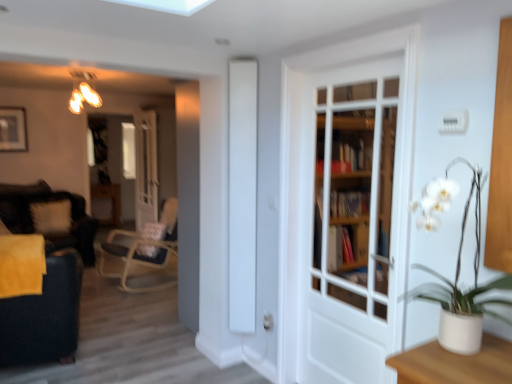
Question: Is matte brass chandelier at upper left positioned in front of white fluffy pillow at left?

Choices:
 (A) yes
 (B) no

Answer: (A)

Question: Does matte brass chandelier at upper left turn towards white fluffy pillow at left?

Choices:
 (A) yes
 (B) no

Answer: (B)

Question: Is matte brass chandelier at upper left oriented away from white fluffy pillow at left?

Choices:
 (A) yes
 (B) no

Answer: (B)

Question: From a real-world perspective, is matte brass chandelier at upper left beneath white fluffy pillow at left?

Choices:
 (A) no
 (B) yes

Answer: (A)

Question: Does matte brass chandelier at upper left lie behind white fluffy pillow at left?

Choices:
 (A) yes
 (B) no

Answer: (B)

Question: Would you say matte brass chandelier at upper left is a long distance from white fluffy pillow at left?

Choices:
 (A) yes
 (B) no

Answer: (A)

Question: Does velvet black swivel chair at left have a greater height compared to white wooden door at center, the second door when ordered from left to right?

Choices:
 (A) yes
 (B) no

Answer: (B)

Question: Is white wooden door at center, the second door when ordered from left to right, located within velvet black swivel chair at left?

Choices:
 (A) no
 (B) yes

Answer: (A)

Question: Considering the relative positions of velvet black swivel chair at left and white wooden door at center, which is the 1th door from right to left, in the image provided, is velvet black swivel chair at left behind white wooden door at center, which is the 1th door from right to left,?

Choices:
 (A) no
 (B) yes

Answer: (B)

Question: Does velvet black swivel chair at left touch white wooden door at center, the second door when ordered from left to right?

Choices:
 (A) yes
 (B) no

Answer: (B)

Question: Is velvet black swivel chair at left closer to the viewer compared to white wooden door at center, which is the 1th door from right to left?

Choices:
 (A) yes
 (B) no

Answer: (B)

Question: Can you confirm if velvet black swivel chair at left is positioned to the right of white wooden door at center, placed as the second door when sorted from back to front?

Choices:
 (A) no
 (B) yes

Answer: (A)

Question: From a real-world perspective, is white fluffy pillow at left on white wooden door at center, placed as the second door when sorted from back to front?

Choices:
 (A) yes
 (B) no

Answer: (B)